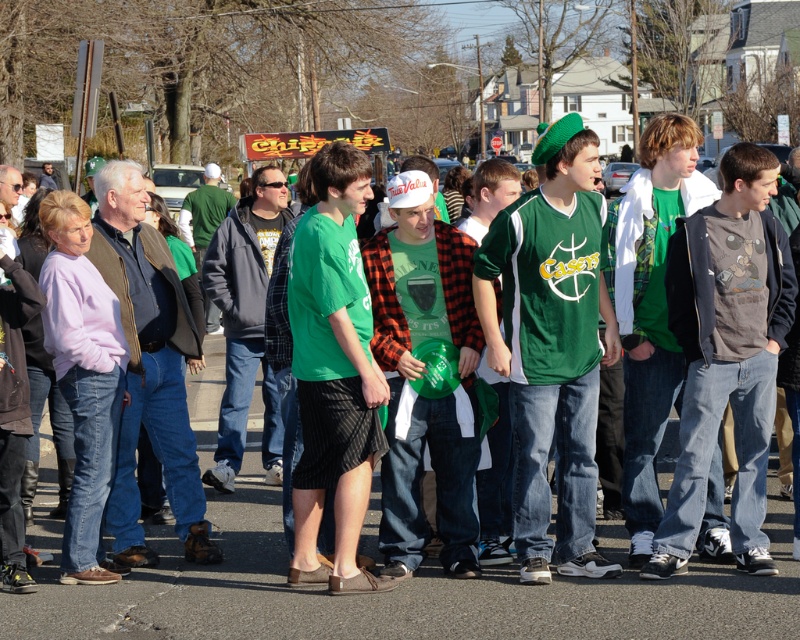
Question: Which point is farther to the camera?

Choices:
 (A) dark gray cotton t-shirt at center
 (B) green fabric shirt at center
 (C) green matte shirt at center
 (D) green plaid shirt at center

Answer: (C)

Question: Which object is the farthest from the green fabric shirt at center?

Choices:
 (A) dark gray cotton t-shirt at center
 (B) green jersey at center
 (C) green plaid shirt at center

Answer: (A)

Question: Based on their relative distances, which object is nearer to the green fabric shirt at center?

Choices:
 (A) dark gray cotton t-shirt at center
 (B) green jersey at center
 (C) green matte shirt at center

Answer: (B)

Question: Can you confirm if green fabric shirt at center is thinner than green plaid shirt at center?

Choices:
 (A) no
 (B) yes

Answer: (B)

Question: Is green jersey at center to the right of green matte shirt at center from the viewer's perspective?

Choices:
 (A) no
 (B) yes

Answer: (A)

Question: Considering the relative positions of dark gray cotton t-shirt at center and green fabric shirt at center in the image provided, where is dark gray cotton t-shirt at center located with respect to green fabric shirt at center?

Choices:
 (A) below
 (B) above

Answer: (B)